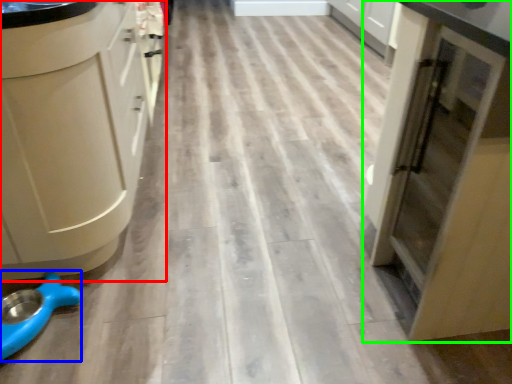
Question: Estimate the real-world distances between objects in this image. Which object is farther from cabinetry (highlighted by a red box), appliance (highlighted by a blue box) or cupboard (highlighted by a green box)?

Choices:
 (A) appliance
 (B) cupboard

Answer: (B)